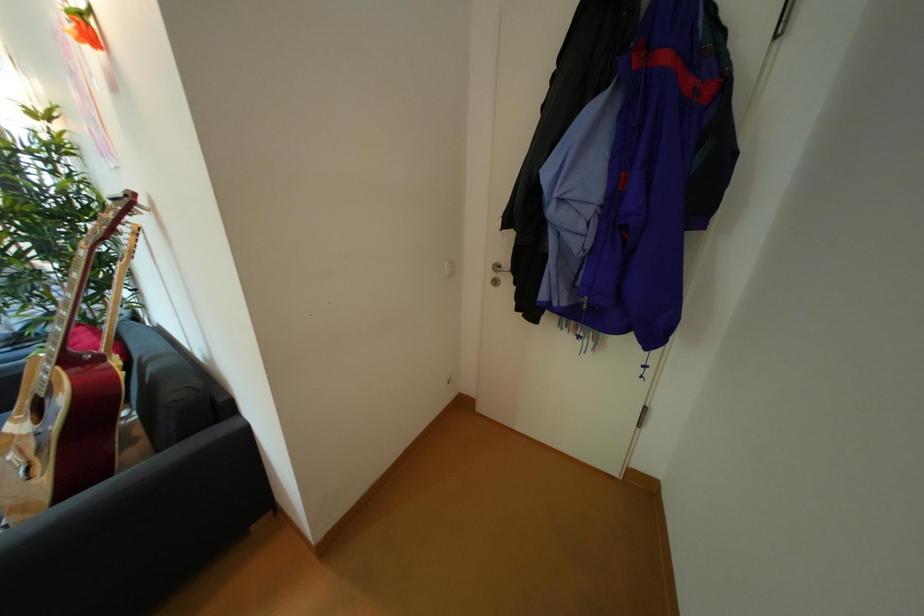
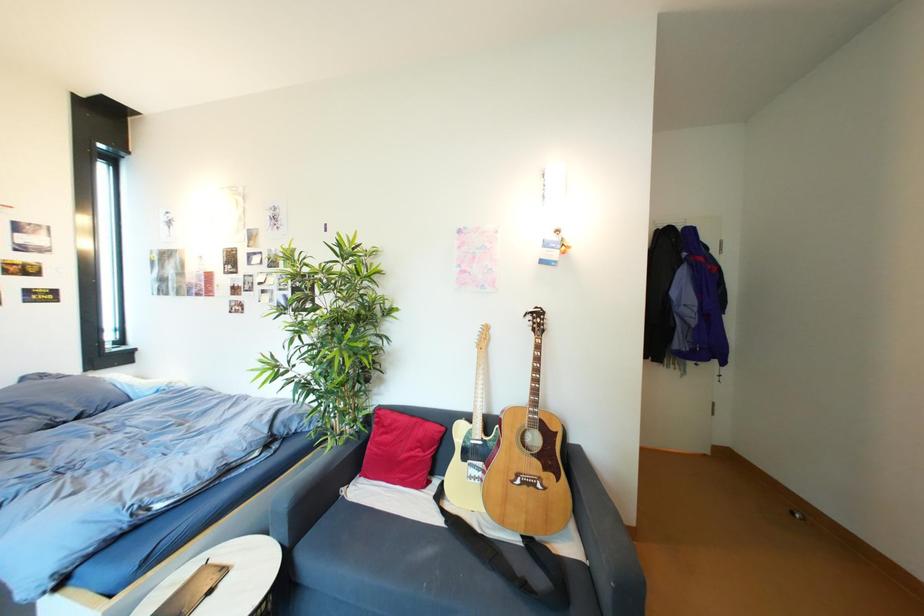
Question: Which direction would the cameraman need to move to produce the second image? Reply with the corresponding letter.

Choices:
 (A) Left
 (B) Right
 (C) Forward
 (D) Backward

Answer: (A)